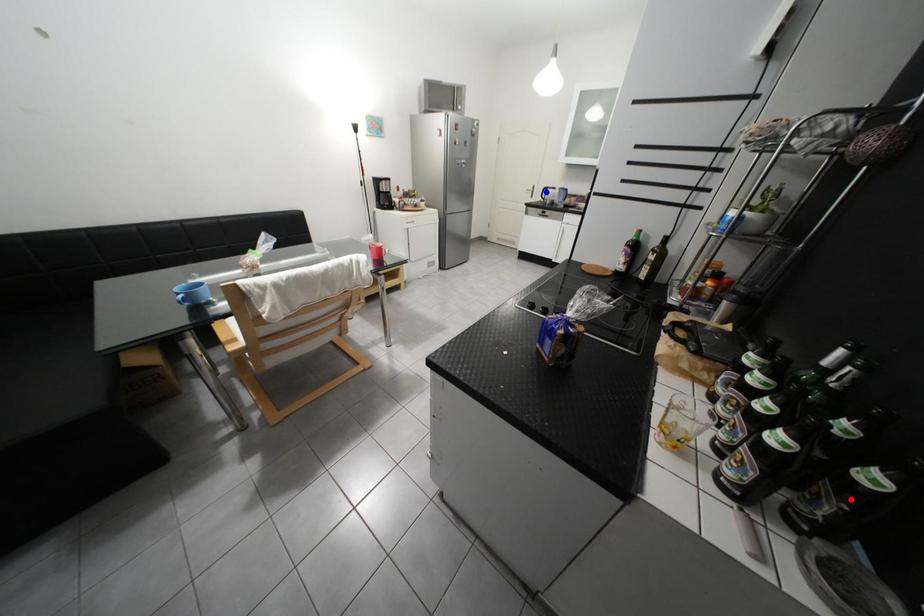
Question: Which of the two points in the image is closer to the camera?

Choices:
 (A) Blue point is closer.
 (B) Red point is closer.

Answer: (B)